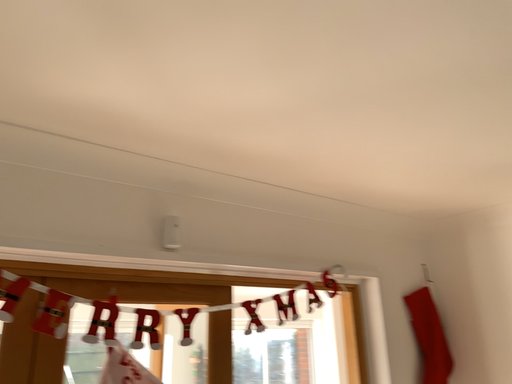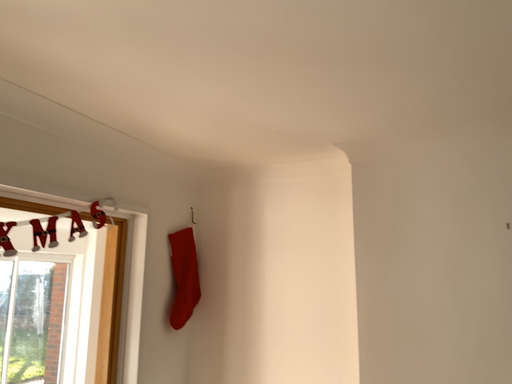
Question: Which way did the camera rotate in the video?

Choices:
 (A) rotated downward
 (B) rotated upward

Answer: (A)